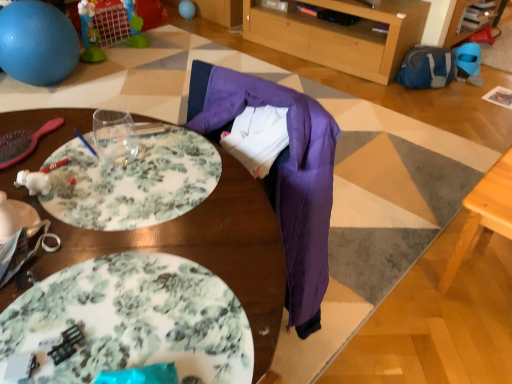
Locate an element on the screen. The height and width of the screenshot is (384, 512). free space in front of white glossy plate at lower left, placed as the 1th plate when sorted from left to right is located at coordinates (28, 307).